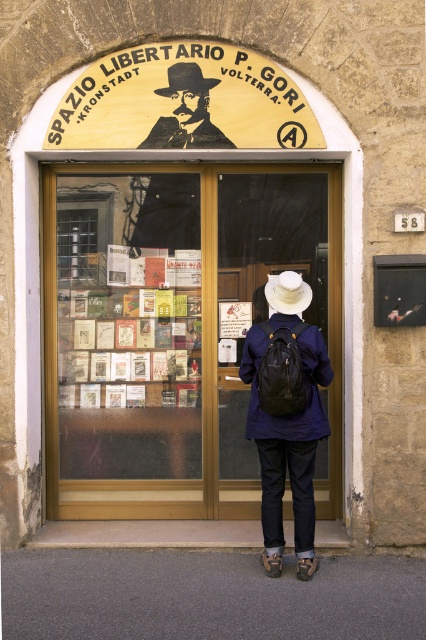
You are a customer entering the building and see the dark blue fabric jacket at center and the matte black suit at upper center. Which clothing item is taller?

The dark blue fabric jacket at center is much taller than the matte black suit at upper center.

You are a delivery person carrying a large box that is 1 meter wide. You need to enter the building through the entrance shown. Can your box fit through the transparent glass door at center if you place it next to the white felt cowboy hat at center?

The transparent glass door at center is wider than the white felt cowboy hat at center, so the box that is 1 meter wide can fit through the transparent glass door at center if placed next to the white felt cowboy hat at center.

You are a delivery person trying to hand a package to the person wearing the white felt cowboy hat at center. The entrance has a transparent glass door at center. Can you directly hand the package to the person without opening the door?

The white felt cowboy hat at center is behind the transparent glass door at center, so you cannot directly hand the package to the person without opening the door.